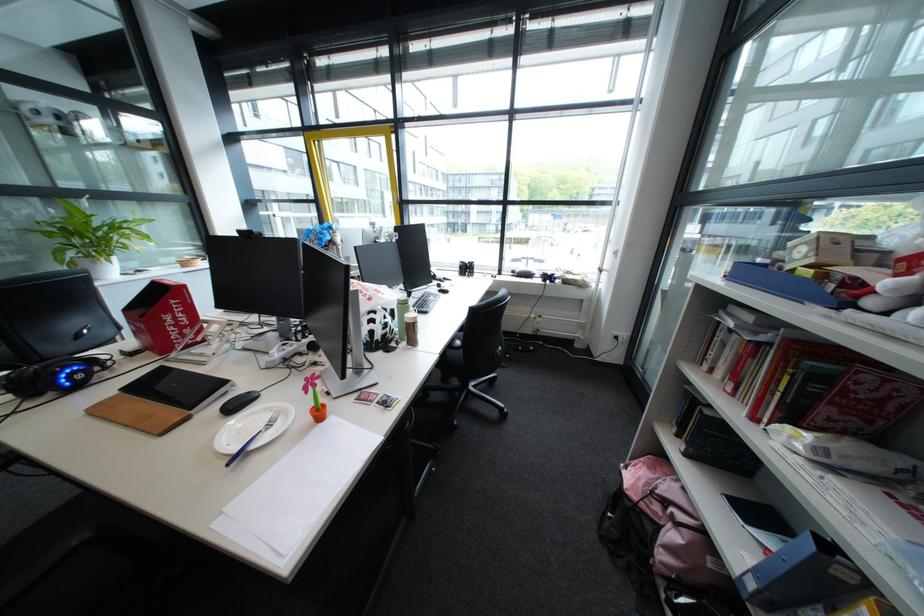
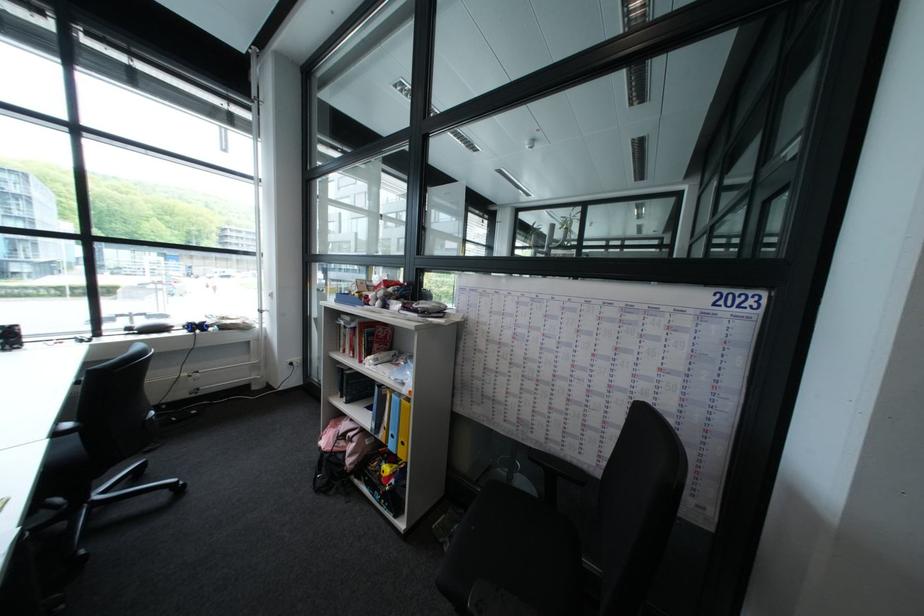
Where in the second image is the point corresponding to (x=465, y=347) from the first image?

(70, 434)